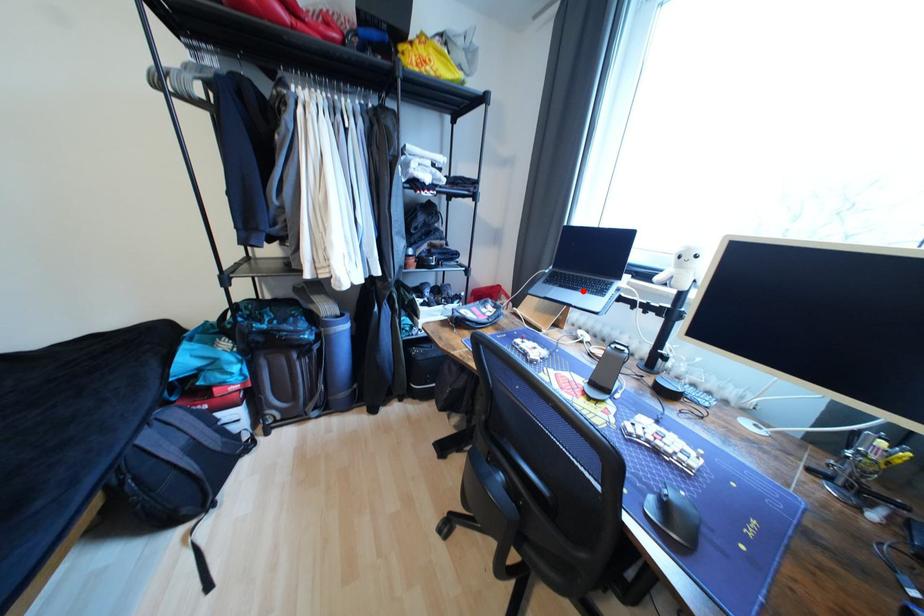
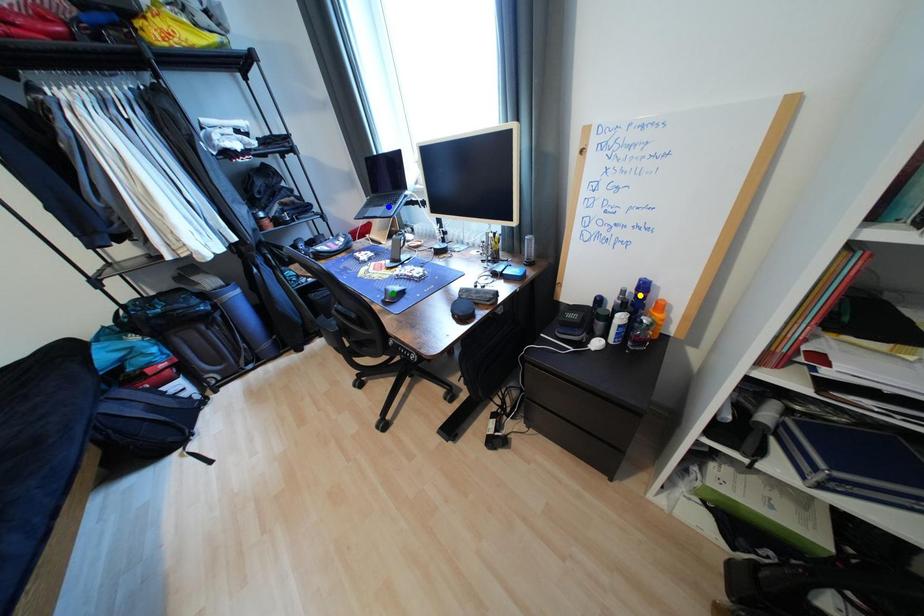
Question: I am providing you with two images of the same scene from different viewpoints. A red point is marked on the first image. You are given multiple points on the second image. In image 2, which mark is for the same physical point as the one in image 1?

Choices:
 (A) green point
 (B) yellow point
 (C) blue point

Answer: (C)